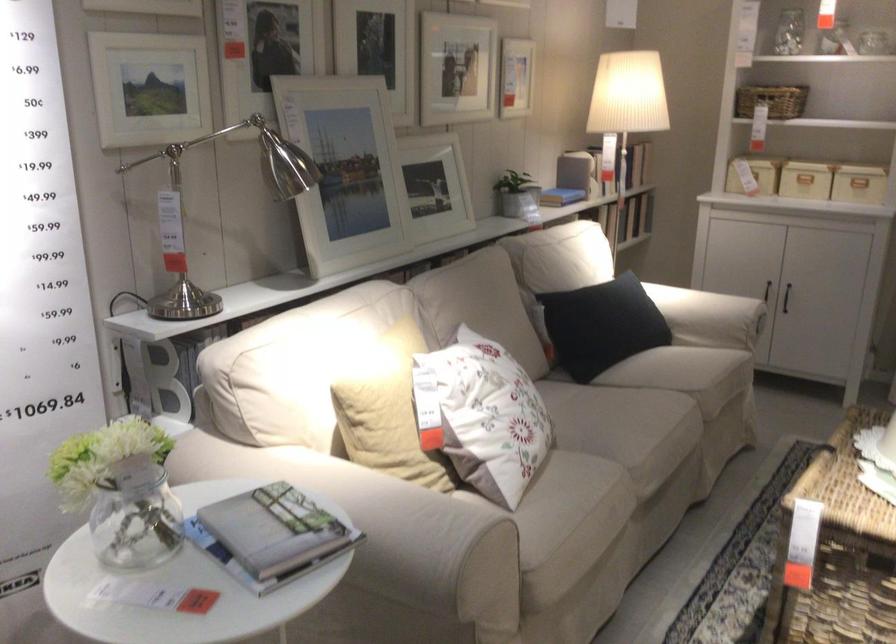
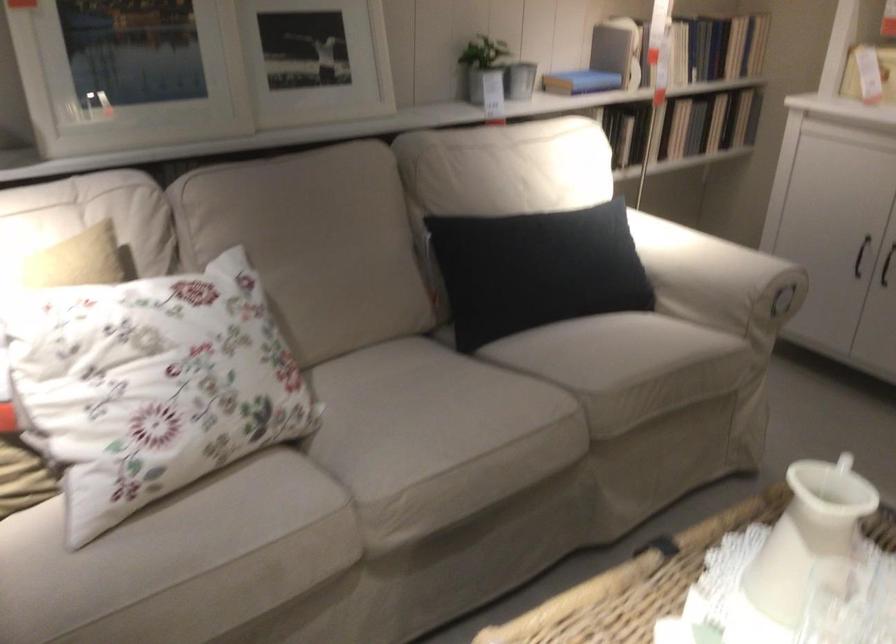
In a continuous first-person perspective shot, in which direction is the camera moving?

The cameraman walked toward right, forward.